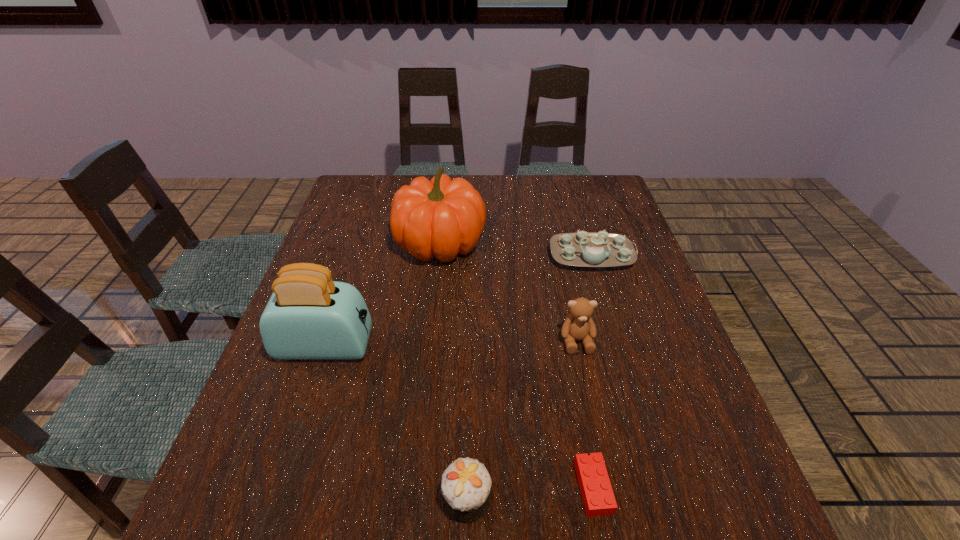
You are a GUI agent. You are given a task and a screenshot of the screen. Output one action in this format:
    pyautogui.click(x=<x>, y=<y>)
    Task: Click on the pumpkin
    This screenshot has height=540, width=960.
    Given the screenshot: What is the action you would take?
    pyautogui.click(x=440, y=218)

This screenshot has width=960, height=540. I want to click on toaster, so click(309, 316).

Where is `teddy bear`? The height and width of the screenshot is (540, 960). teddy bear is located at coordinates (578, 325).

Where is `chinaware`? This screenshot has width=960, height=540. chinaware is located at coordinates (583, 249).

The height and width of the screenshot is (540, 960). Find the location of `cupcake`. cupcake is located at coordinates (466, 484).

This screenshot has height=540, width=960. In order to click on Lego in this screenshot , I will do `click(597, 494)`.

The height and width of the screenshot is (540, 960). What are the coordinates of `free region located 0.170m on the front of the pumpkin` in the screenshot? It's located at (432, 319).

I want to click on vacant space located 0.240m on the side of the toaster with the lever, so click(x=479, y=346).

Locate an element on the screen. This screenshot has width=960, height=540. blank space located on the face of the teddy bear is located at coordinates (596, 435).

Find the location of a particular element. This screenshot has width=960, height=540. free space located on the front of the chinaware is located at coordinates (615, 339).